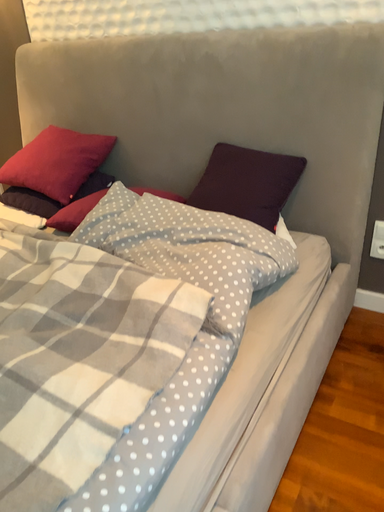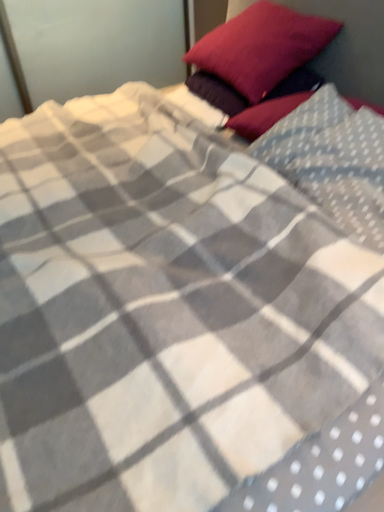
Question: Which way did the camera rotate in the video?

Choices:
 (A) rotated downward
 (B) rotated upward

Answer: (A)